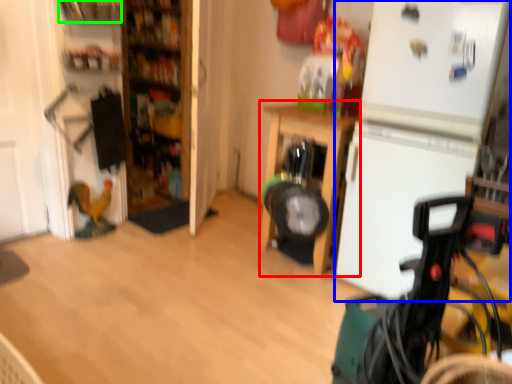
Question: Which object is the closest to the furniture (highlighted by a red box)? Choose among these: fridge (highlighted by a blue box) or shelf (highlighted by a green box).

Choices:
 (A) fridge
 (B) shelf

Answer: (A)